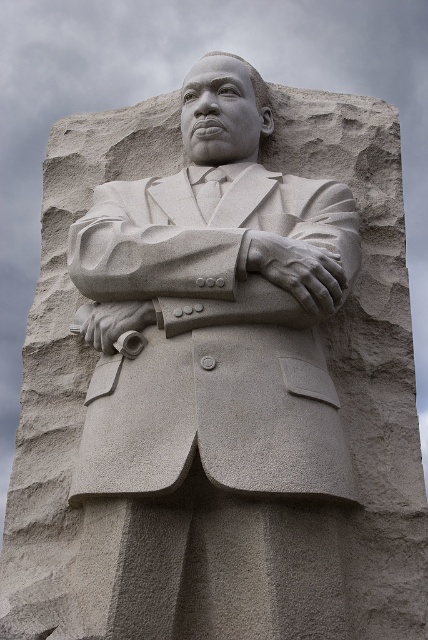
Does gray stone statue at center have a smaller size compared to sanded stone arm at center?

Incorrect, gray stone statue at center is not smaller in size than sanded stone arm at center.

Is point (142, 202) in front of point (157, 188)?

Yes, point (142, 202) is in front of point (157, 188).

This screenshot has width=428, height=640. Find the location of `gray stone statue at center`. gray stone statue at center is located at coordinates (214, 310).